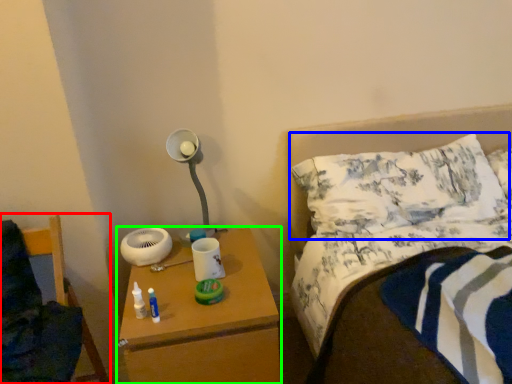
Question: Which object is positioned farthest from furniture (highlighted by a red box)? Select from pillow (highlighted by a blue box) and nightstand (highlighted by a green box).

Choices:
 (A) pillow
 (B) nightstand

Answer: (A)